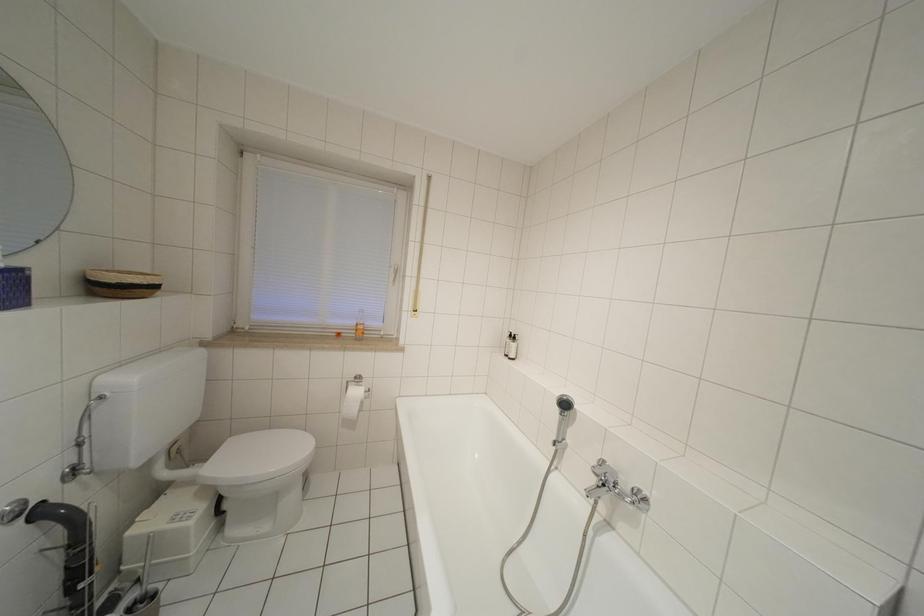
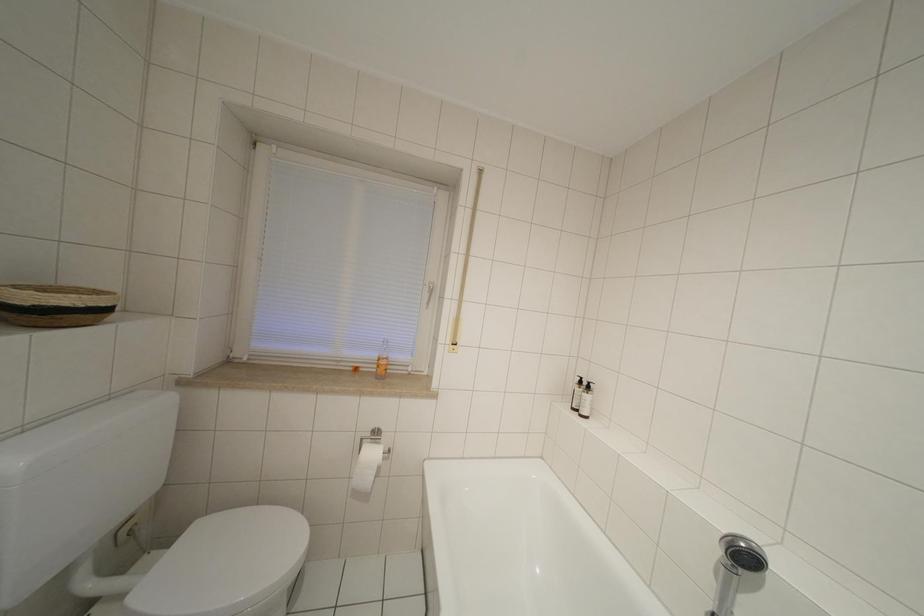
Question: How did the camera likely rotate?

Choices:
 (A) Left
 (B) Right
 (C) Up
 (D) Down

Answer: (A)